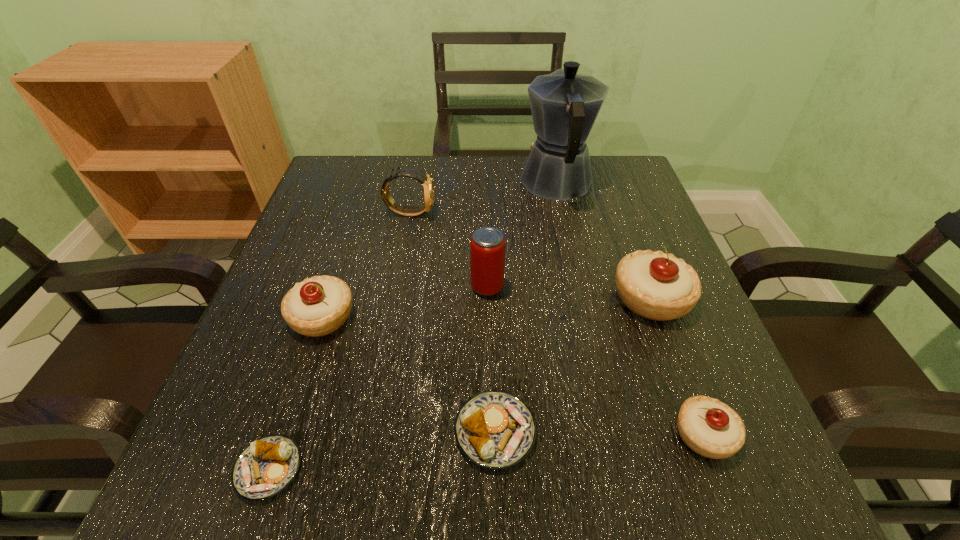
Locate an element on the screen. Image resolution: width=960 pixels, height=540 pixels. unoccupied area between the shortest pastry and the fourth tallest pastry is located at coordinates (382, 450).

Locate which object ranks fourth in proximity to the shortest object. Please provide its 2D coordinates. Your answer should be formatted as a tuple, i.e. [(x, y)], where the tuple contains the x and y coordinates of a point satisfying the conditions above.

[(428, 188)]

Locate which object ranks in proximity to the third shortest object. Please provide its 2D coordinates. Your answer should be formatted as a tuple, i.e. [(x, y)], where the tuple contains the x and y coordinates of a point satisfying the conditions above.

[(654, 285)]

Identify which pastry is the third closest to the tallest pastry. Please provide its 2D coordinates. Your answer should be formatted as a tuple, i.e. [(x, y)], where the tuple contains the x and y coordinates of a point satisfying the conditions above.

[(317, 306)]

Select which pastry appears as the closest to the beer can. Please provide its 2D coordinates. Your answer should be formatted as a tuple, i.e. [(x, y)], where the tuple contains the x and y coordinates of a point satisfying the conditions above.

[(654, 285)]

Locate which beige pastry is the third closest to the tallest object. Please provide its 2D coordinates. Your answer should be formatted as a tuple, i.e. [(x, y)], where the tuple contains the x and y coordinates of a point satisfying the conditions above.

[(709, 427)]

Select which beige pastry appears as the second closest to the tallest pastry. Please provide its 2D coordinates. Your answer should be formatted as a tuple, i.e. [(x, y)], where the tuple contains the x and y coordinates of a point satisfying the conditions above.

[(317, 306)]

Locate an element on the screen. free space in the image that satisfies the following two spatial constraints: 1. on the face of the watch; 2. on the left side of the beer can is located at coordinates (396, 286).

This screenshot has height=540, width=960. I want to click on free location that satisfies the following two spatial constraints: 1. on the front side of the smallest beige pastry; 2. on the right side of the biggest beige pastry, so click(702, 434).

Where is `blank space that satisfies the following two spatial constraints: 1. on the face of the sixth object from right to left; 2. on the left side of the nearest beige pastry`? blank space that satisfies the following two spatial constraints: 1. on the face of the sixth object from right to left; 2. on the left side of the nearest beige pastry is located at coordinates (369, 434).